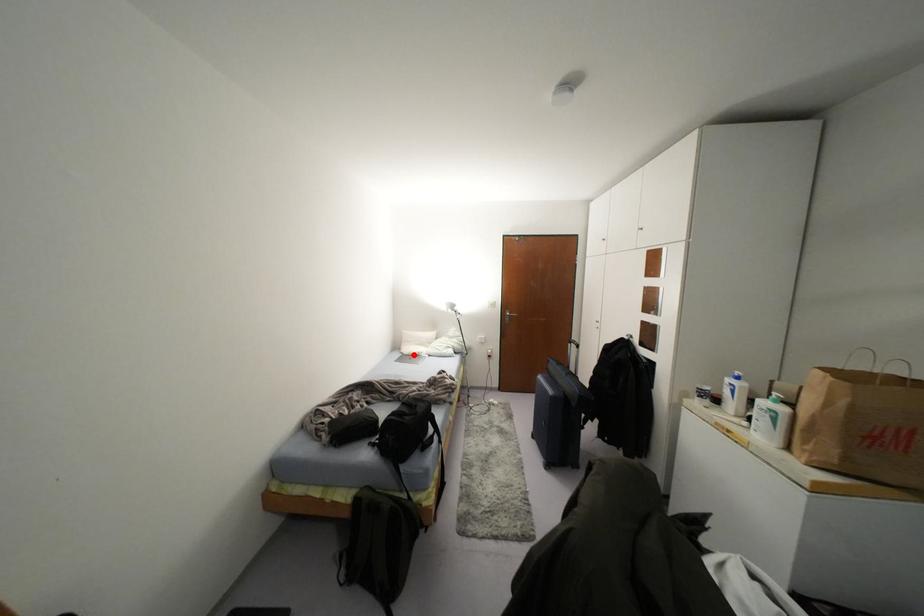
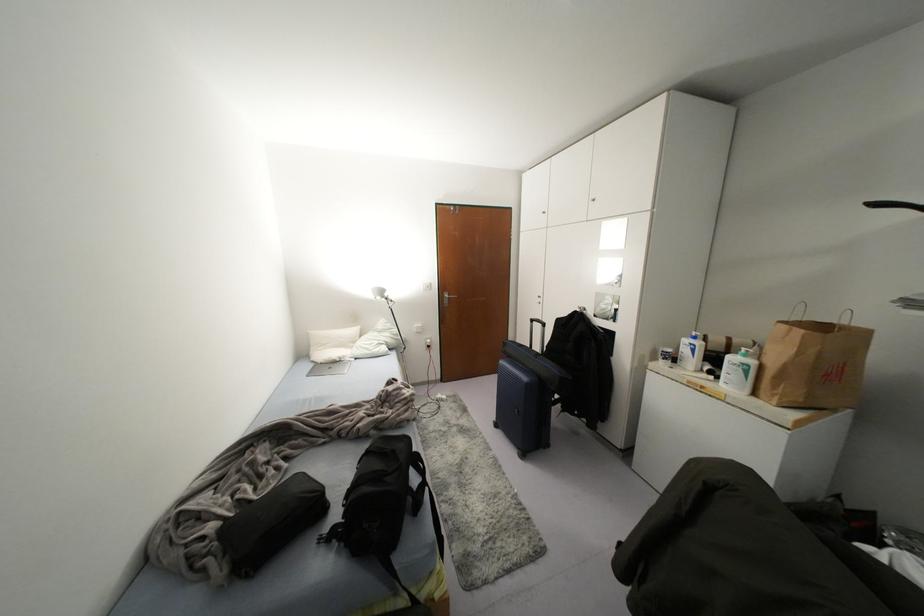
Question: A red point is marked in image1. In image2, is the corresponding 3D point closer to the camera or farther? Reply with the corresponding letter.

Choices:
 (A) The corresponding 3D point is closer.
 (B) The corresponding 3D point is farther.

Answer: (A)